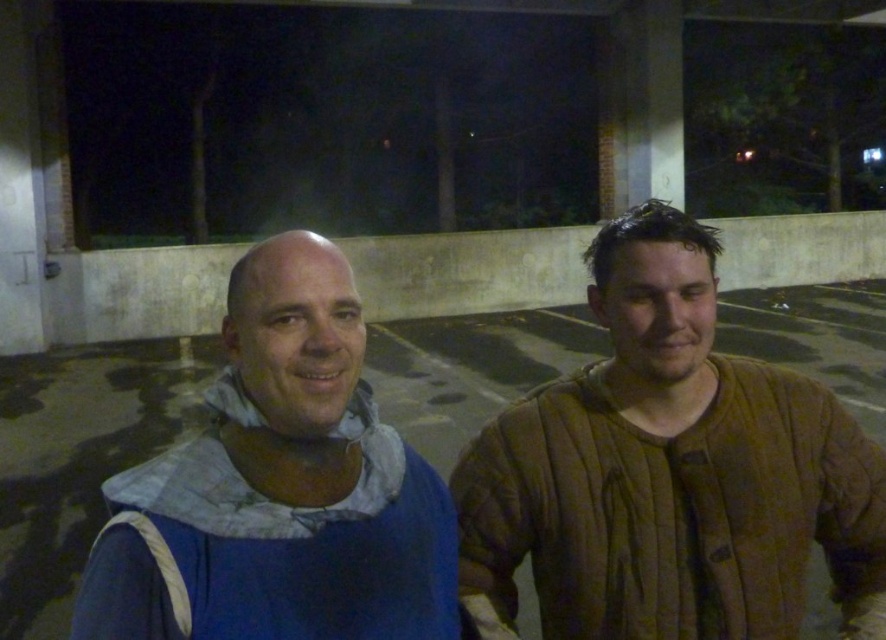
Can you confirm if brown quilted jacket at right is smaller than blue fabric at left?

No.

Can you confirm if brown quilted jacket at right is positioned above blue fabric at left?

Yes, brown quilted jacket at right is above blue fabric at left.

Describe the element at coordinates (669, 472) in the screenshot. The image size is (886, 640). I see `brown quilted jacket at right` at that location.

Locate an element on the screen. brown quilted jacket at right is located at coordinates (669, 472).